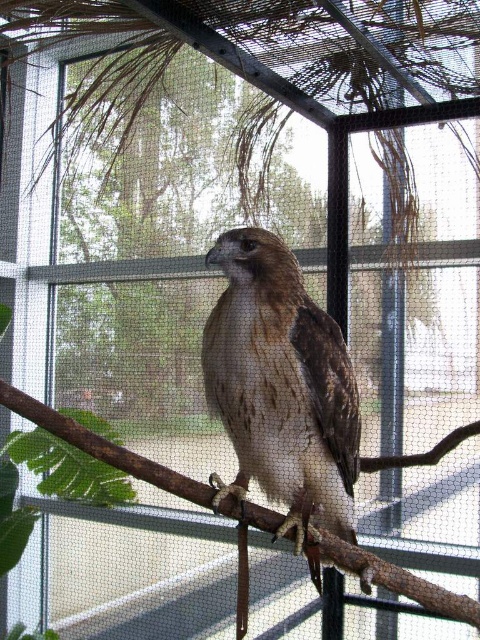
Consider the image. You are a bird enthusiast observing the aviary. You notice the brown feathered eagle at center and the brown wood tree branch at center. Which object takes up more space in the image?

The brown wood tree branch at center takes up more space in the image because the brown feathered eagle at center has a smaller size compared to it.

You are a zookeeper who wants to feed the brown feathered eagle at center. You have a 10 inch long feeding stick. Can you safely reach the eagle from the brown wood tree branch at center without getting too close?

The distance between the brown feathered eagle at center and the brown wood tree branch at center is 8.50 inches. Since the feeding stick is 10 inches long, it is long enough to reach the eagle from the branch without needing to get closer than 8.50 inches.

You are a zookeeper who needs to ensure the brown feathered eagle at center has enough space to stretch its wings. Given that the brown wood tree branch at center is the main perch, can the eagle fully extend its wings without touching the enclosure walls or other structures?

The brown feathered eagle at center is taller than the brown wood tree branch at center. This indicates that the eagle may not have enough space to fully extend its wings since its height exceeds that of the perch. The zookeeper should check the enclosure dimensions to ensure adequate space.